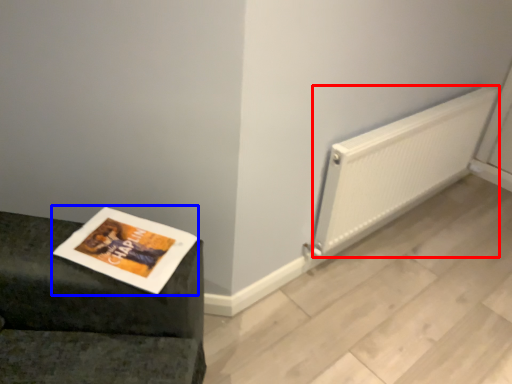
Question: Which point is further to the camera, radiator (highlighted by a red box) or magazine (highlighted by a blue box)?

Choices:
 (A) radiator
 (B) magazine

Answer: (A)